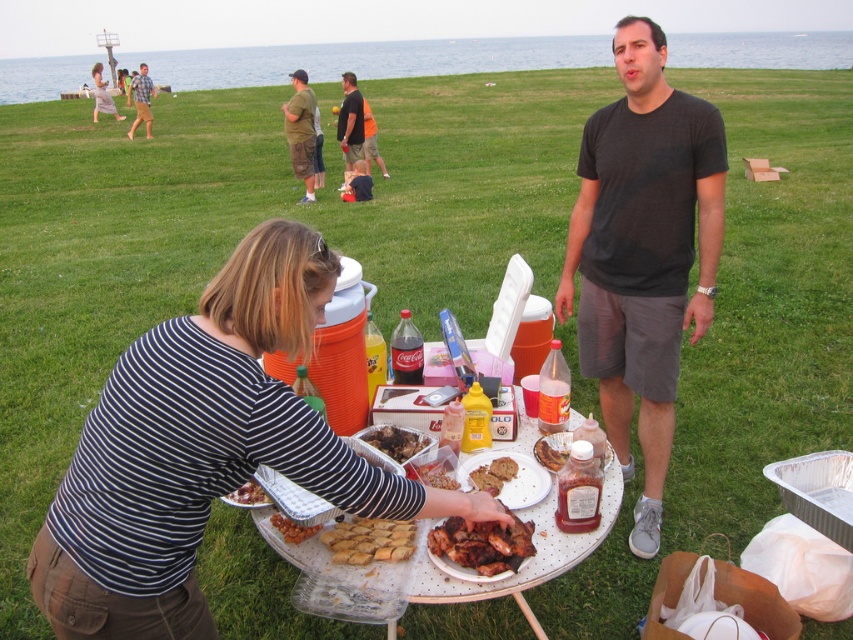
You are standing at the edge of the grassy field and want to place a new decorative item on the white polka dot table at center. Based on the coordinates provided, can you determine the exact 2D position where you should place the item?

The white polka dot table at center is located at the 2D coordinates point (531, 560), so you should place the decorative item at that exact point.